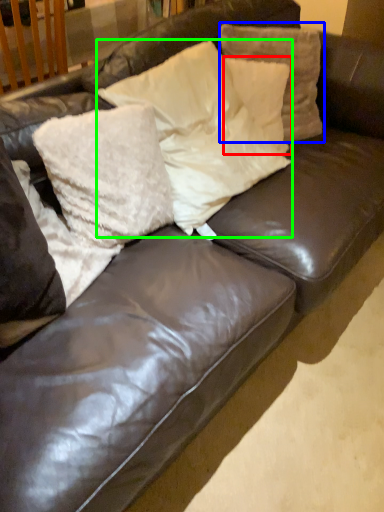
Question: Which is nearer to the pillow (highlighted by a red box)? pillow (highlighted by a blue box) or pillow (highlighted by a green box).

Choices:
 (A) pillow
 (B) pillow

Answer: (A)